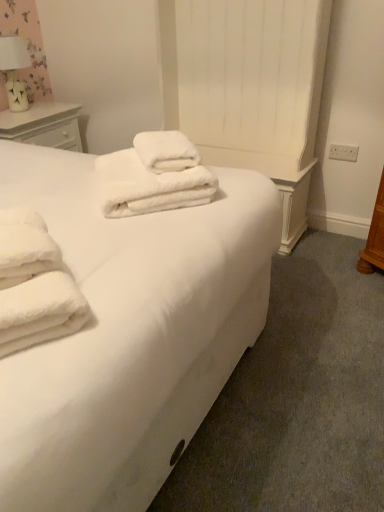
Question: From the image's perspective, is white ceramic table lamp at upper left above or below white wood nightstand at upper left?

Choices:
 (A) above
 (B) below

Answer: (A)

Question: Considering the positions of white ceramic table lamp at upper left and white wood nightstand at upper left in the image, is white ceramic table lamp at upper left bigger or smaller than white wood nightstand at upper left?

Choices:
 (A) small
 (B) big

Answer: (A)

Question: Which of these objects is positioned closest to the white ceramic table lamp at upper left?

Choices:
 (A) white wood nightstand at upper left
 (B) white soft towels at center
 (C) white fluffy towels at center

Answer: (A)

Question: Considering the real-world distances, which object is farthest from the white soft towels at center?

Choices:
 (A) white wood nightstand at upper left
 (B) white ceramic table lamp at upper left
 (C) white fluffy towels at center

Answer: (B)